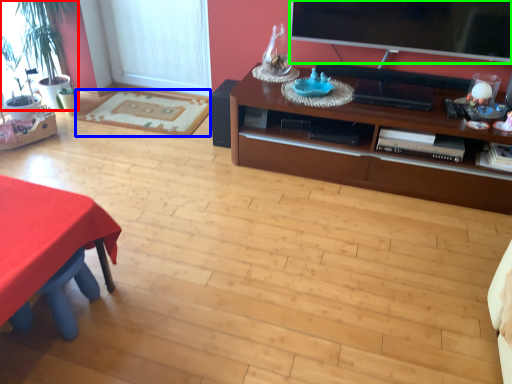
Question: Considering the real-world distances, which object is closest to houseplant (highlighted by a red box)? flat (highlighted by a blue box) or television (highlighted by a green box).

Choices:
 (A) flat
 (B) television

Answer: (A)